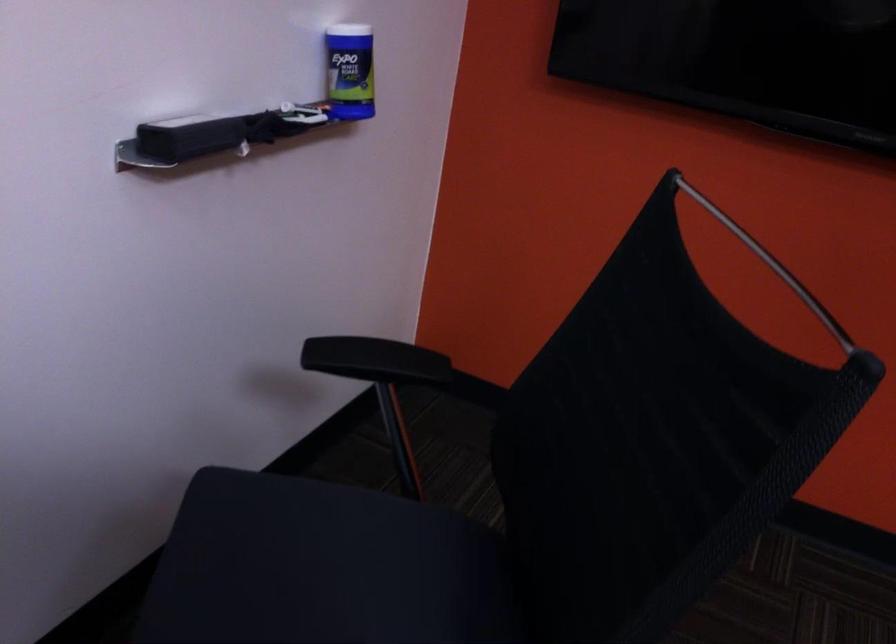
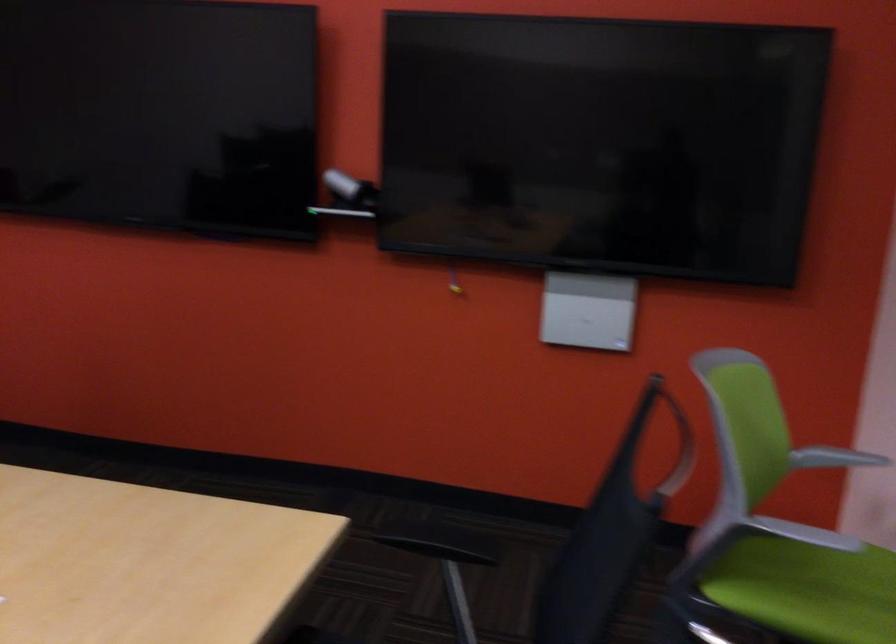
Which direction would the cameraman need to move to produce the second image?

The cameraman moved toward right, backward.